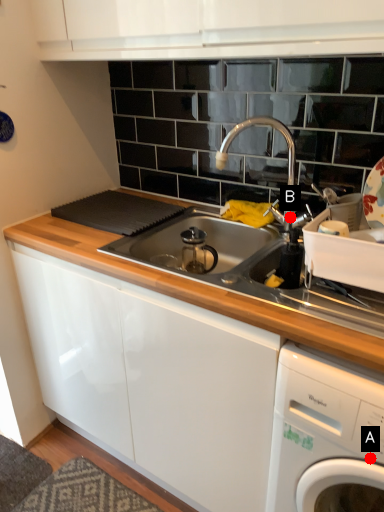
Question: Two points are circled on the image, labeled by A and B beside each circle. Which point appears closest to the camera in this image?

Choices:
 (A) A is closer
 (B) B is closer

Answer: (A)